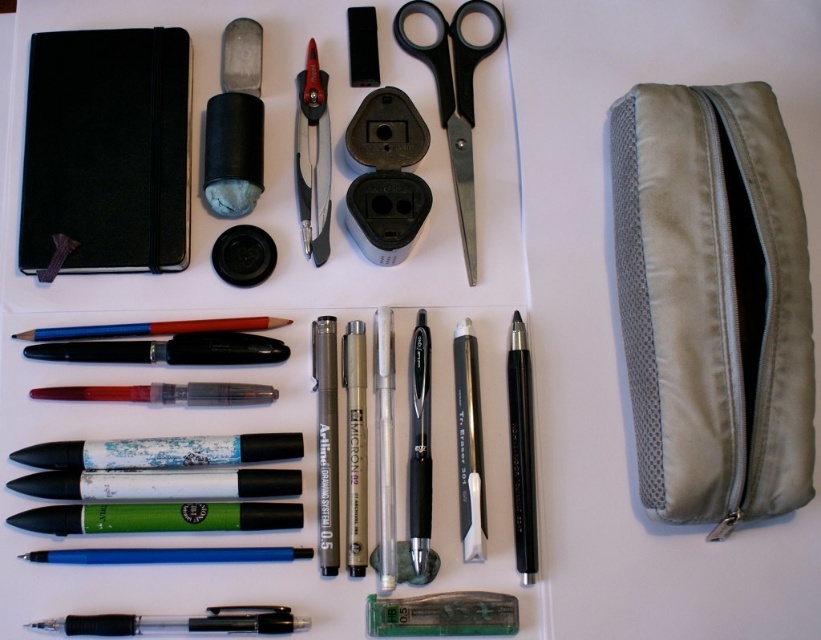
Is olive green fabric pouch at right thinner than black matte notebook at upper left?

Correct, olive green fabric pouch at right's width is less than black matte notebook at upper left's.

What do you see at coordinates (713, 301) in the screenshot? The width and height of the screenshot is (821, 640). I see `olive green fabric pouch at right` at bounding box center [713, 301].

What do you see at coordinates (713, 301) in the screenshot? This screenshot has width=821, height=640. I see `olive green fabric pouch at right` at bounding box center [713, 301].

Image resolution: width=821 pixels, height=640 pixels. I want to click on olive green fabric pouch at right, so click(x=713, y=301).

Is olive green fabric pouch at right smaller than black metal scissors at upper center?

No, olive green fabric pouch at right is not smaller than black metal scissors at upper center.

Who is lower down, olive green fabric pouch at right or black metal scissors at upper center?

olive green fabric pouch at right is below.

Between point (617, 260) and point (453, 152), which one is positioned behind?

The point (453, 152) is behind.

Find the location of a particular element. This screenshot has width=821, height=640. olive green fabric pouch at right is located at coordinates (713, 301).

Between black metal scissors at upper center and black plastic scissors at upper center, which one appears on the left side from the viewer's perspective?

black plastic scissors at upper center

Which is behind, point (457, 74) or point (306, 124)?

Positioned behind is point (457, 74).

Image resolution: width=821 pixels, height=640 pixels. In order to click on black metal scissors at upper center in this screenshot , I will do `click(453, 97)`.